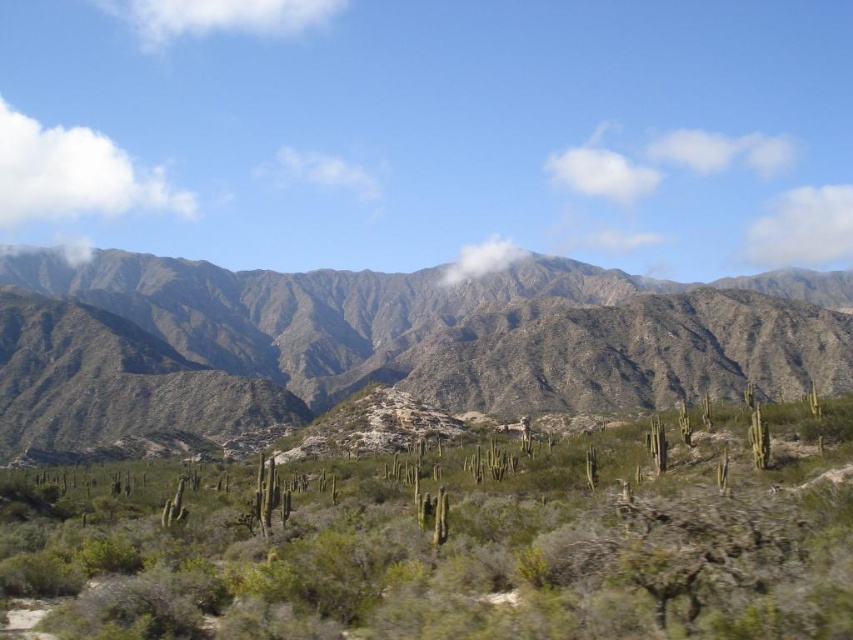
Question: Which point appears farthest from the camera in this image?

Choices:
 (A) (701, 552)
 (B) (289, 346)

Answer: (B)

Question: Among these points, which one is farthest from the camera?

Choices:
 (A) (546, 628)
 (B) (421, 349)

Answer: (B)

Question: From the image, what is the correct spatial relationship of green spiky cactus at center in relation to green textured mountain range at center?

Choices:
 (A) left
 (B) right

Answer: (B)

Question: From the image, what is the correct spatial relationship of green spiky cactus at center in relation to green textured mountain range at center?

Choices:
 (A) left
 (B) right

Answer: (B)

Question: Among these points, which one is nearest to the camera?

Choices:
 (A) (498, 381)
 (B) (151, 531)

Answer: (B)

Question: Is green spiky cactus at center thinner than green textured mountain range at center?

Choices:
 (A) yes
 (B) no

Answer: (A)